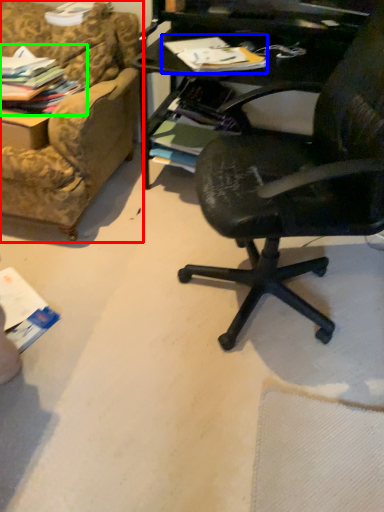
Question: Estimate the real-world distances between objects in this image. Which object is farther from studio couch (highlighted by a red box), magazine (highlighted by a blue box) or magazine (highlighted by a green box)?

Choices:
 (A) magazine
 (B) magazine

Answer: (A)